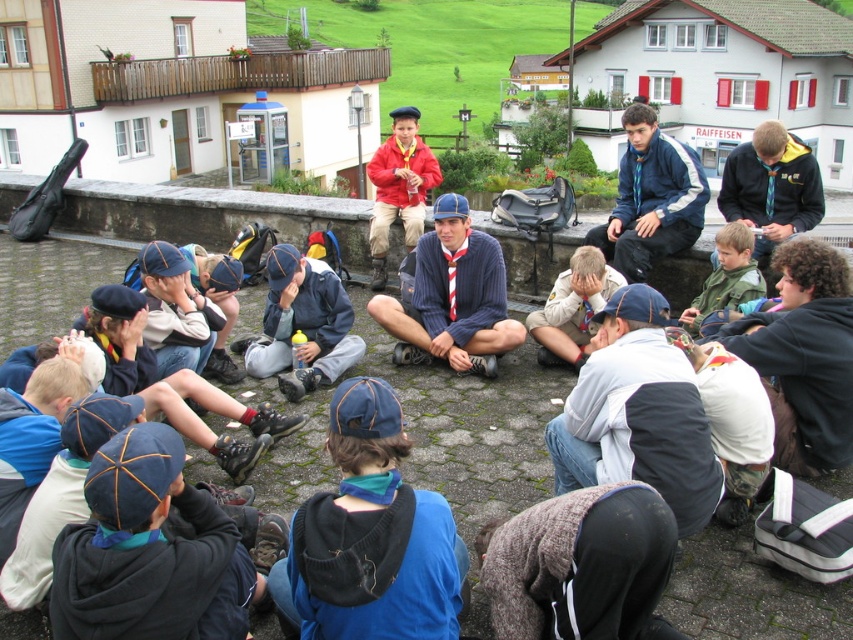
Is white fleece jacket at center to the left of curly-haired boy at center from the viewer's perspective?

Indeed, white fleece jacket at center is positioned on the left side of curly-haired boy at center.

Is point (556, 468) behind point (840, 314)?

No, (556, 468) is in front of (840, 314).

Image resolution: width=853 pixels, height=640 pixels. What are the coordinates of `white fleece jacket at center` in the screenshot? It's located at (637, 413).

Where is `white fleece jacket at center`? white fleece jacket at center is located at coordinates (637, 413).

Between point (561, 486) and point (672, 182), which one is positioned in front?

Positioned in front is point (561, 486).

In the scene shown: Who is more distant from viewer, (666,392) or (671,173)?

Positioned behind is point (671,173).

Where is `white fleece jacket at center`? The width and height of the screenshot is (853, 640). white fleece jacket at center is located at coordinates (637, 413).

Does curly-haired boy at center lie in front of light brown uniform at center?

Yes.

Does point (821, 346) come in front of point (575, 323)?

That is True.

Identify the location of curly-haired boy at center. This screenshot has width=853, height=640. (804, 356).